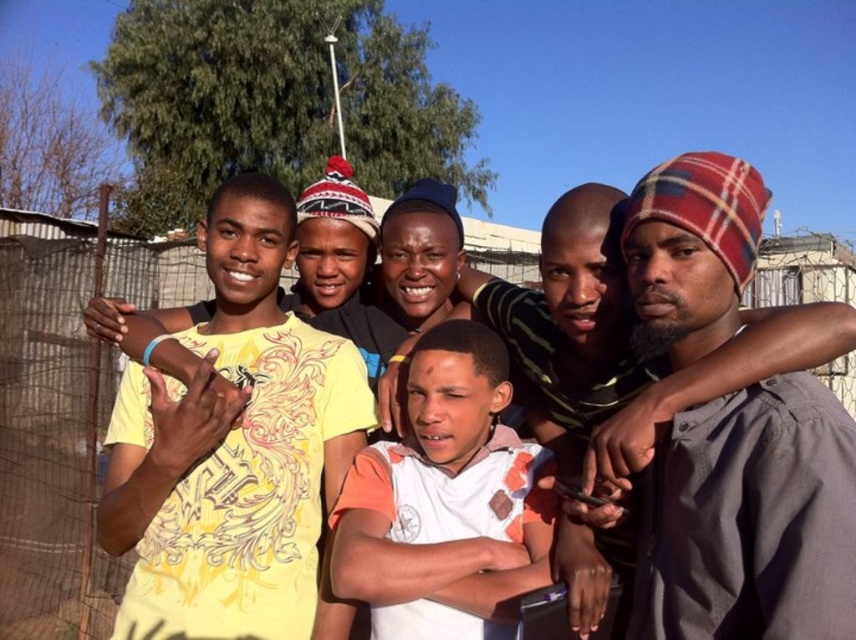
You are a photographer trying to capture a photo of the plaid fabric beanie at center and the metallic wire mesh at center. Based on their positions, which object is located on the left side of the other?

The metallic wire mesh at center is on the left side of the plaid fabric beanie at center.

Consider the image. You are a photographer trying to capture a clear shot of the plaid fabric beanie at center and the metallic wire mesh at center. Which object is closer to the camera?

The plaid fabric beanie at center is located below the metallic wire mesh at center, meaning it is closer to the camera.